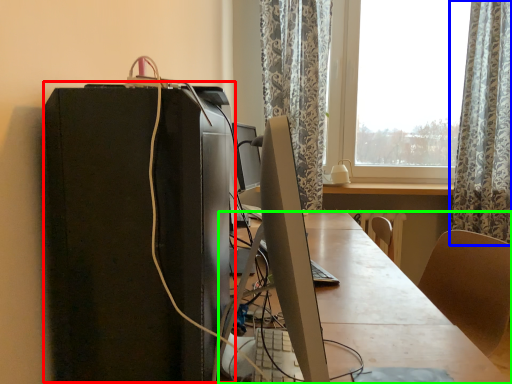
Question: Which is farther away from computer tower (highlighted by a red box)? curtain (highlighted by a blue box) or desk (highlighted by a green box)?

Choices:
 (A) curtain
 (B) desk

Answer: (A)